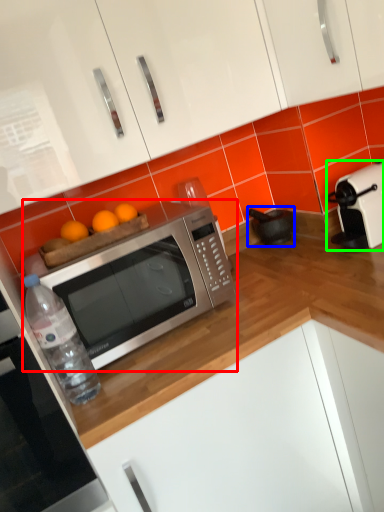
Question: Based on their relative distances, which object is nearer to microwave oven (highlighted by a red box)? Choose from appliance (highlighted by a blue box) and toaster (highlighted by a green box).

Choices:
 (A) appliance
 (B) toaster

Answer: (B)